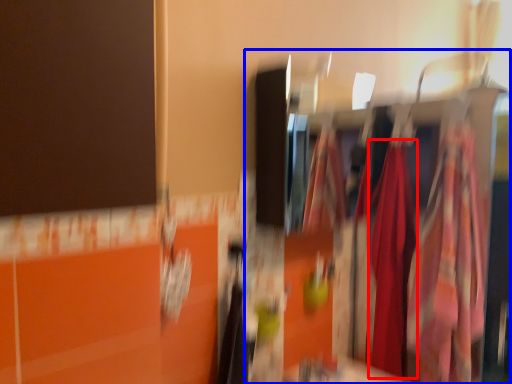
Question: Which of the following is the closest to the observer, clothing (highlighted by a red box) or closet (highlighted by a blue box)?

Choices:
 (A) clothing
 (B) closet

Answer: (B)